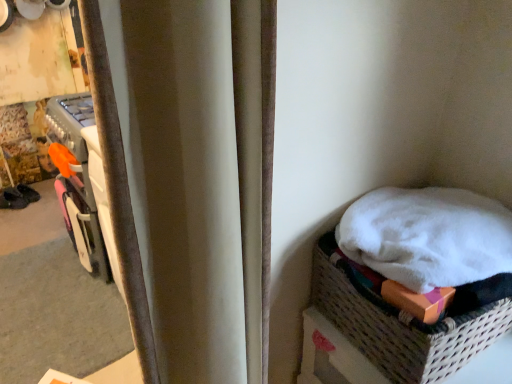
Question: Should I look upward or downward to see white woven basket at lower right?

Choices:
 (A) up
 (B) down

Answer: (B)

Question: Is velvet curtain at center aimed at white woven basket at lower right?

Choices:
 (A) no
 (B) yes

Answer: (A)

Question: From the image's perspective, would you say velvet curtain at center is positioned over white woven basket at lower right?

Choices:
 (A) no
 (B) yes

Answer: (B)

Question: From the image's perspective, is velvet curtain at center located beneath white woven basket at lower right?

Choices:
 (A) yes
 (B) no

Answer: (B)

Question: Considering the relative sizes of velvet curtain at center and white woven basket at lower right in the image provided, is velvet curtain at center wider than white woven basket at lower right?

Choices:
 (A) no
 (B) yes

Answer: (A)

Question: Considering the relative positions of velvet curtain at center and white woven basket at lower right in the image provided, is velvet curtain at center to the right of white woven basket at lower right from the viewer's perspective?

Choices:
 (A) yes
 (B) no

Answer: (B)

Question: Is the position of velvet curtain at center more distant than that of white woven basket at lower right?

Choices:
 (A) no
 (B) yes

Answer: (A)

Question: From a real-world perspective, is white woven basket at lower right below velvet curtain at center?

Choices:
 (A) yes
 (B) no

Answer: (A)

Question: From a real-world perspective, does white woven basket at lower right stand above velvet curtain at center?

Choices:
 (A) yes
 (B) no

Answer: (B)

Question: From the image's perspective, does white woven basket at lower right appear lower than velvet curtain at center?

Choices:
 (A) yes
 (B) no

Answer: (A)

Question: Is there a large distance between white woven basket at lower right and velvet curtain at center?

Choices:
 (A) yes
 (B) no

Answer: (B)

Question: Does white woven basket at lower right have a smaller size compared to velvet curtain at center?

Choices:
 (A) yes
 (B) no

Answer: (A)

Question: Is white woven basket at lower right surrounding velvet curtain at center?

Choices:
 (A) yes
 (B) no

Answer: (B)

Question: Is dark brown leather shoe at left behind white woven basket at lower right?

Choices:
 (A) no
 (B) yes

Answer: (B)